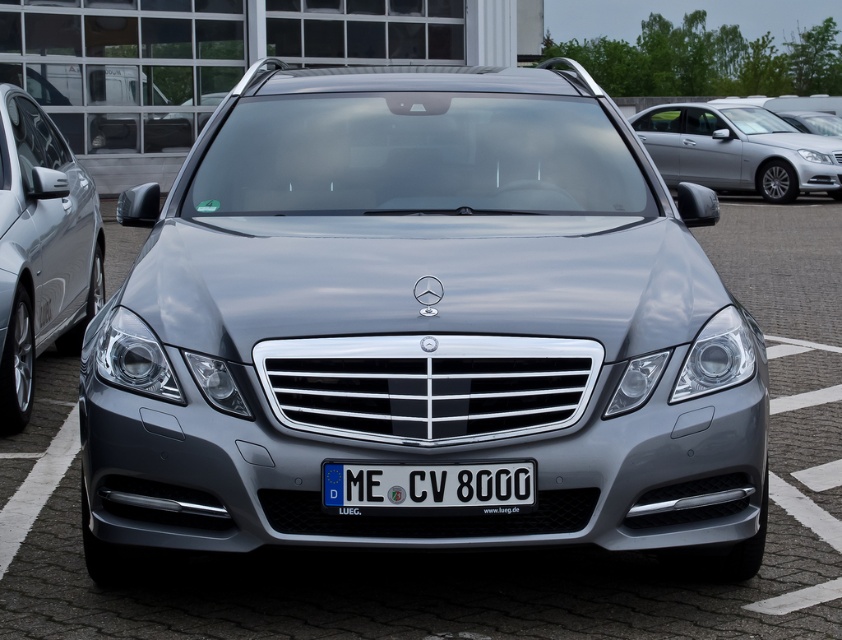
Question: Considering the relative positions of satin silver car at left and satin silver car at upper right in the image provided, where is satin silver car at left located with respect to satin silver car at upper right?

Choices:
 (A) above
 (B) below

Answer: (B)

Question: Considering the relative positions of satin metallic car at center and black plastic license plate at center in the image provided, where is satin metallic car at center located with respect to black plastic license plate at center?

Choices:
 (A) right
 (B) left

Answer: (B)

Question: Which of the following is the farthest from the observer?

Choices:
 (A) satin silver car at upper right
 (B) black plastic license plate at center
 (C) satin silver car at left

Answer: (A)

Question: Based on their relative distances, which object is farther from the satin silver car at upper right?

Choices:
 (A) black plastic license plate at center
 (B) satin silver car at left
 (C) satin metallic car at center

Answer: (A)

Question: Is satin metallic car at center bigger than satin silver car at upper right?

Choices:
 (A) yes
 (B) no

Answer: (B)

Question: Among these objects, which one is nearest to the camera?

Choices:
 (A) black plastic license plate at center
 (B) satin silver car at left
 (C) satin metallic car at center
 (D) satin silver car at upper right

Answer: (A)